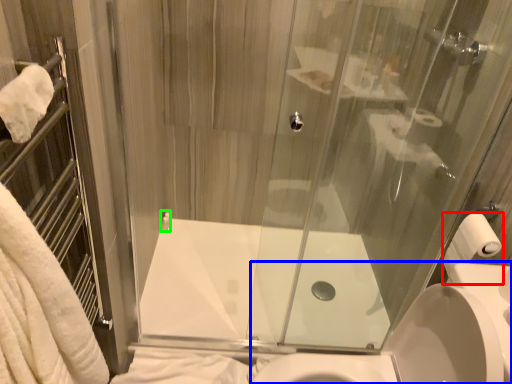
Question: Which object is positioned closest to toilet paper (highlighted by a red box)? Select from sink (highlighted by a blue box) and towel bar (highlighted by a green box).

Choices:
 (A) sink
 (B) towel bar

Answer: (A)